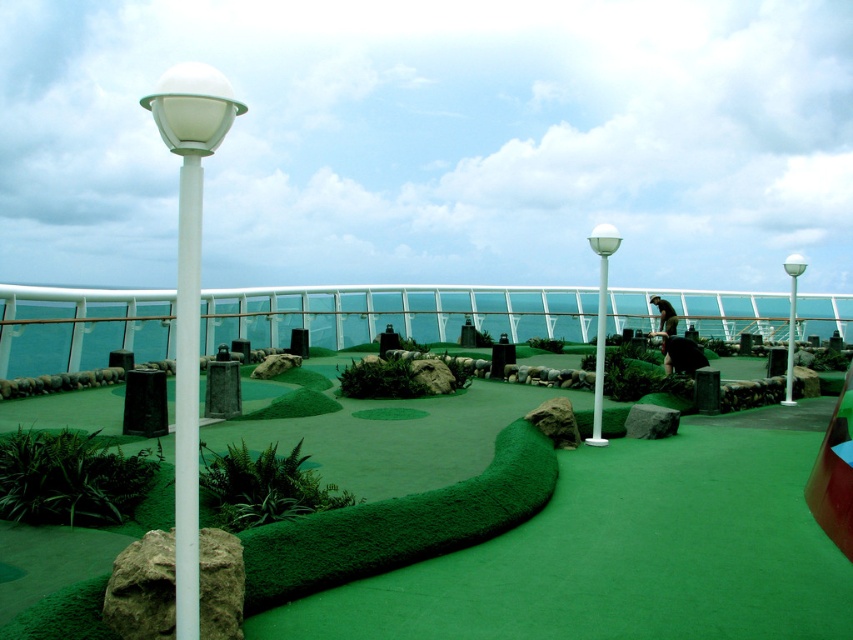
You are a miniature golf player holding a ball and club. You see the green artificial turf at center and the white plastic pole at left. Which object is bigger in size?

The green artificial turf at center has a larger size compared to the white plastic pole at left.

You are a golfer standing at the tee on the cruise ship mini golf course. You need to hit the ball towards the green artificial turf at center, but there is a white glossy lamp post at left in your way. Can you safely hit the ball over the lamp post without hitting it?

The green artificial turf at center is not as tall as the white glossy lamp post at left, so the ball would need to clear the lamp post to reach the turf. Since the lamp post is taller, hitting over it might be challenging but possible if the shot is high enough.